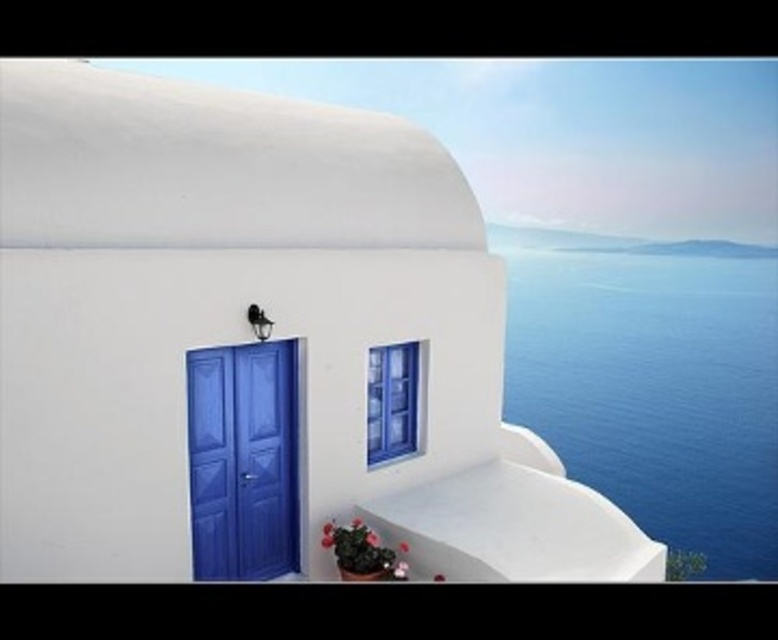
Does blue water at right lie behind blue glass window at center?

Yes, it is.

Can you confirm if blue water at right is positioned above blue glass window at center?

No, blue water at right is not above blue glass window at center.

Who is more distant from viewer, (601,346) or (377,372)?

The point (601,346) is behind.

This screenshot has height=640, width=778. Find the location of `blue water at right`. blue water at right is located at coordinates (654, 381).

From the picture: Who is more forward, (748, 392) or (202, 433)?

Point (202, 433) is more forward.

Locate an element on the screen. This screenshot has height=640, width=778. blue water at right is located at coordinates (654, 381).

Can you confirm if matte blue door at lower left is positioned to the right of blue glass window at center?

Incorrect, matte blue door at lower left is not on the right side of blue glass window at center.

Between matte blue door at lower left and blue glass window at center, which one appears on the right side from the viewer's perspective?

Positioned to the right is blue glass window at center.

I want to click on matte blue door at lower left, so click(x=242, y=460).